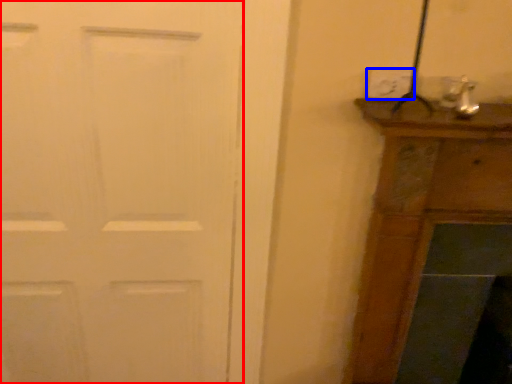
Question: Which of the following is the closest to the observer, door (highlighted by a red box) or electric outlet (highlighted by a blue box)?

Choices:
 (A) door
 (B) electric outlet

Answer: (A)